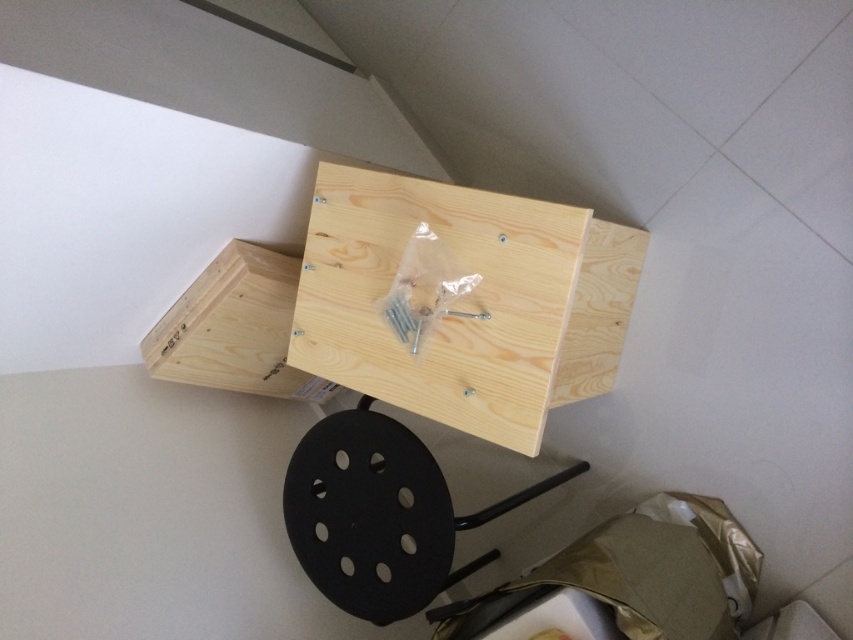
You are trying to assemble a shelving unit and need to place a tool on the natural wood board at center. If your arm reaches 34 inches, can you comfortably place the tool on it without stretching?

The natural wood board at center is 35.07 inches away from the camera, which is slightly beyond your arm reach of 34 inches. You may need to stretch or adjust your position to place the tool.

You are standing in the room and want to place a small object exactly halfway between point (399, 196) and point (250, 276). Which direction should you move from the first point to reach the halfway point?

To find the halfway point between point (399, 196) and point (250, 276), you should move towards the second point by calculating the average of their coordinates. The halfway point would be at coordinates 0.3715, 0.382. Since the first point is at (399, 196) and the second is at (250, 276), moving towards the second point from the first point will reach the halfway position.